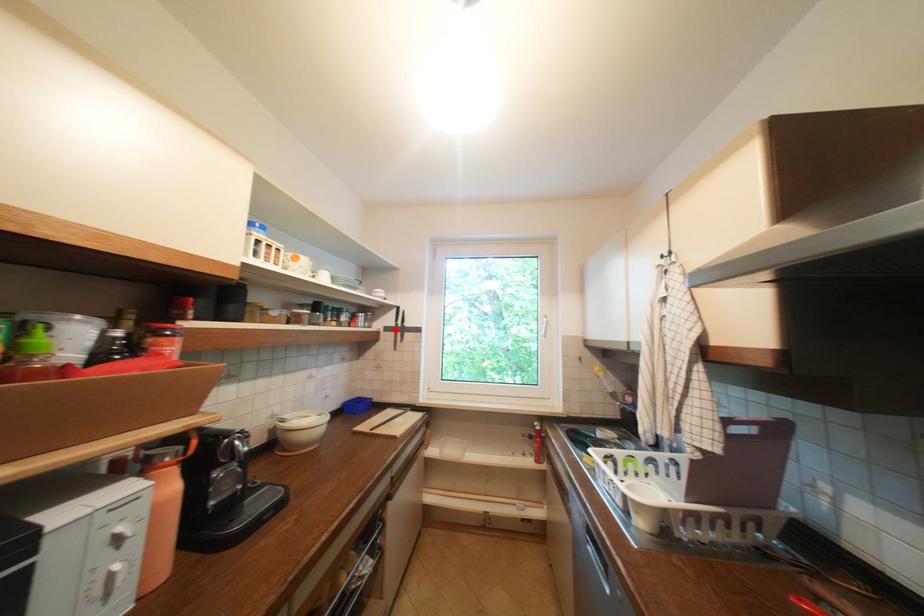
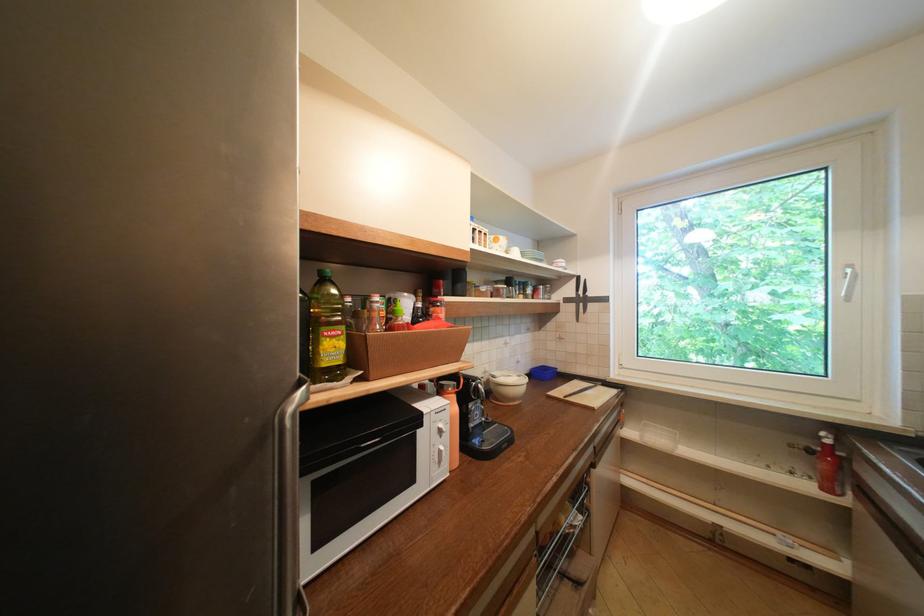
Where in the second image is the point corresponding to the highlighted location from the first image?

(575, 301)